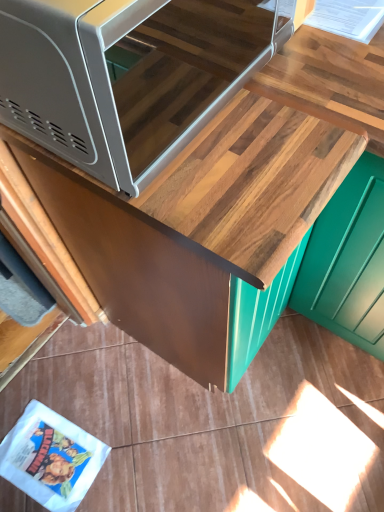
Where is `empty space that is ontop of wooden cabinet at upper center (from a real-world perspective)`? empty space that is ontop of wooden cabinet at upper center (from a real-world perspective) is located at coordinates (208, 130).